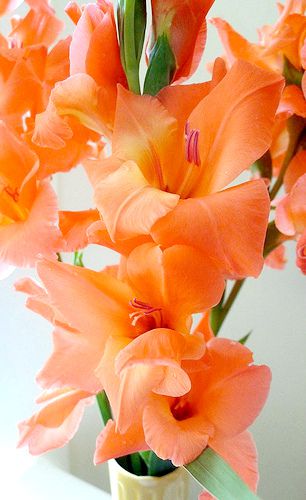
This screenshot has width=306, height=500. In order to click on table vase is on in this screenshot , I will do `click(59, 495)`.